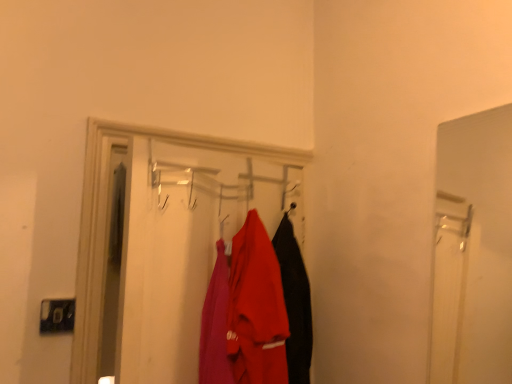
Question: Considering their positions, is matte red shirt at center located in front of or behind matte plastic coat rack at center?

Choices:
 (A) front
 (B) behind

Answer: (B)

Question: Is matte red shirt at center wider or thinner than matte plastic coat rack at center?

Choices:
 (A) wide
 (B) thin

Answer: (A)

Question: Visually, is matte red shirt at center positioned to the left or to the right of matte plastic coat rack at center?

Choices:
 (A) right
 (B) left

Answer: (A)

Question: Considering the positions of matte plastic coat rack at center and matte red shirt at center in the image, is matte plastic coat rack at center wider or thinner than matte red shirt at center?

Choices:
 (A) thin
 (B) wide

Answer: (A)

Question: From the image's perspective, is matte plastic coat rack at center above or below matte red shirt at center?

Choices:
 (A) below
 (B) above

Answer: (B)

Question: Visually, is matte plastic coat rack at center positioned to the left or to the right of matte red shirt at center?

Choices:
 (A) right
 (B) left

Answer: (B)

Question: Based on their sizes in the image, would you say matte plastic coat rack at center is bigger or smaller than matte red shirt at center?

Choices:
 (A) big
 (B) small

Answer: (A)